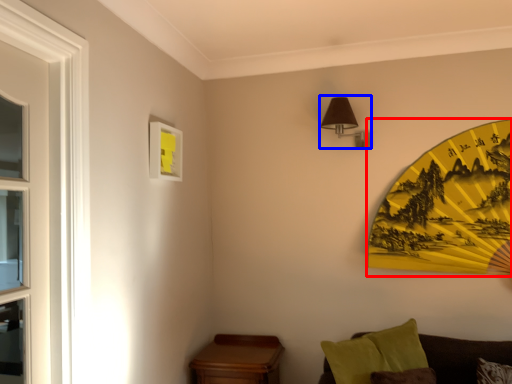
Question: Which object is closer to the camera taking this photo, design (highlighted by a red box) or light fixture (highlighted by a blue box)?

Choices:
 (A) design
 (B) light fixture

Answer: (A)